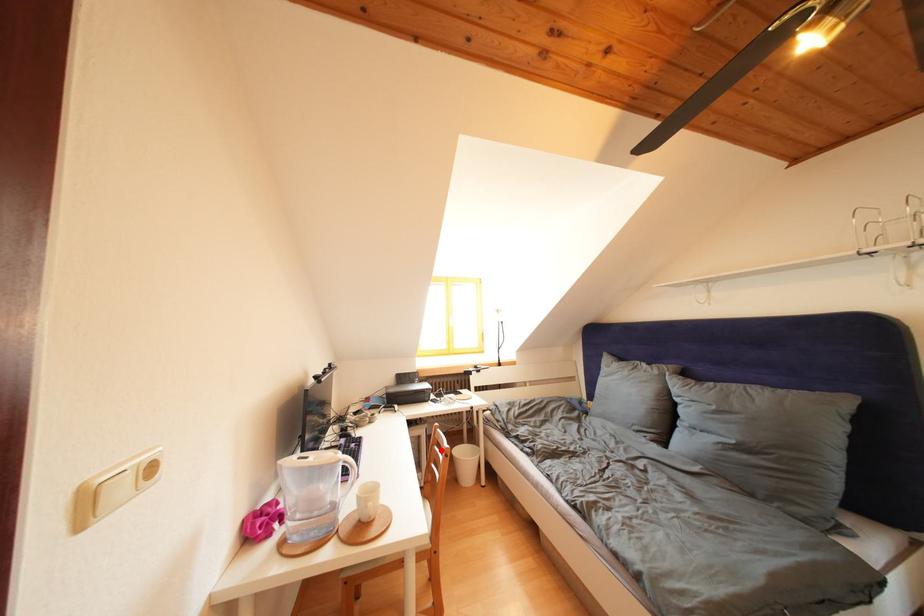
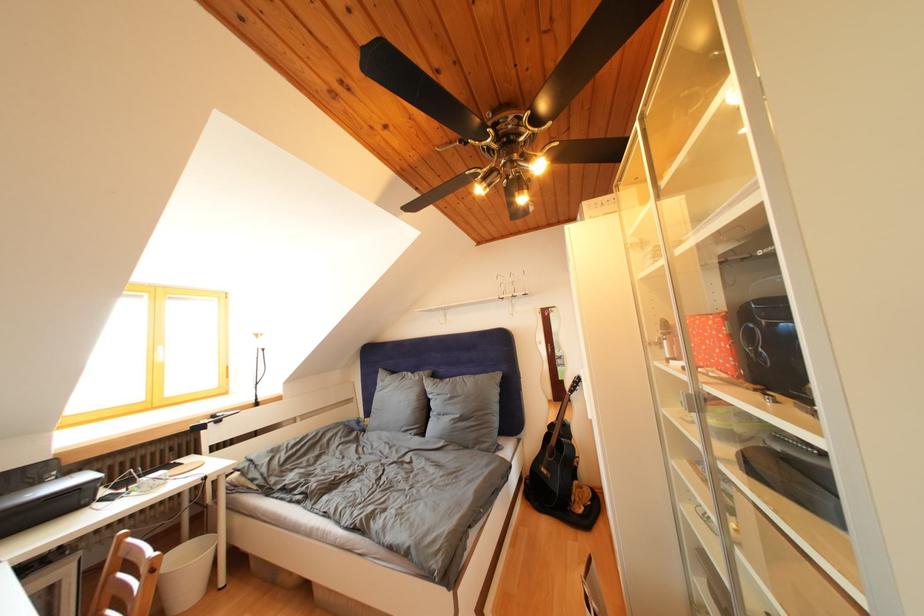
Locate, in the second image, the point that corresponds to the highlighted location in the first image.

(119, 578)